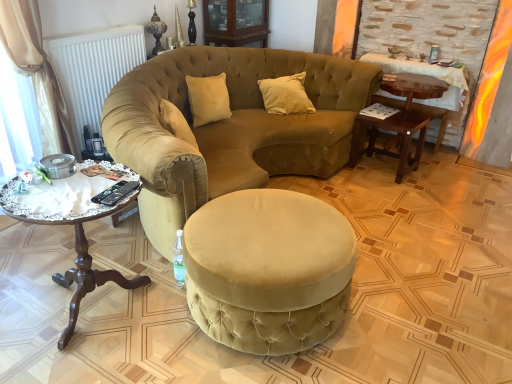
You are a GUI agent. You are given a task and a screenshot of the screen. Output one action in this format:
    pyautogui.click(x=<x>, y=<y>)
    Task: Click on the vacant space behind woodenwoodencoffee table at left
    
    Given the screenshot: What is the action you would take?
    pyautogui.click(x=112, y=251)